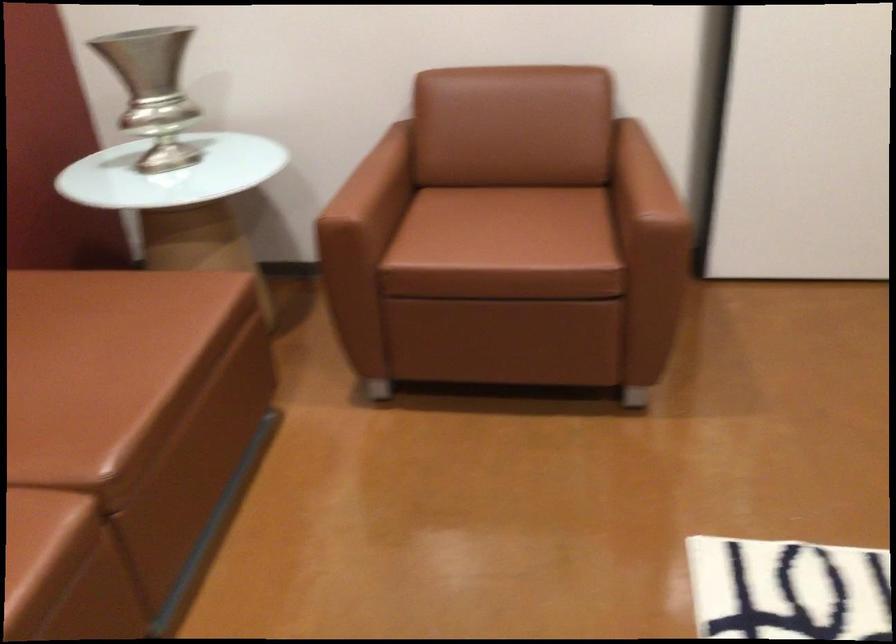
Where would you sit the brown chair surface? Please return your answer as a coordinate pair (x, y).

(81, 357)